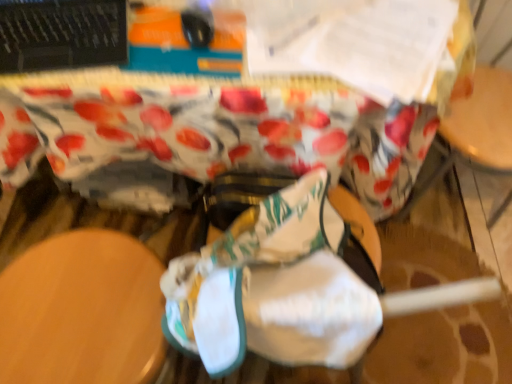
At what (x,y) coordinates should I click in order to perform the action: click on white fabric shoe at center. Please return your answer as a coordinate pair (x, y). This screenshot has width=512, height=384. Looking at the image, I should click on [x=273, y=288].

Describe the element at coordinates (273, 288) in the screenshot. This screenshot has height=384, width=512. I see `white fabric shoe at center` at that location.

Locate an element on the screen. Image resolution: width=512 pixels, height=384 pixels. white fabric shoe at center is located at coordinates (273, 288).